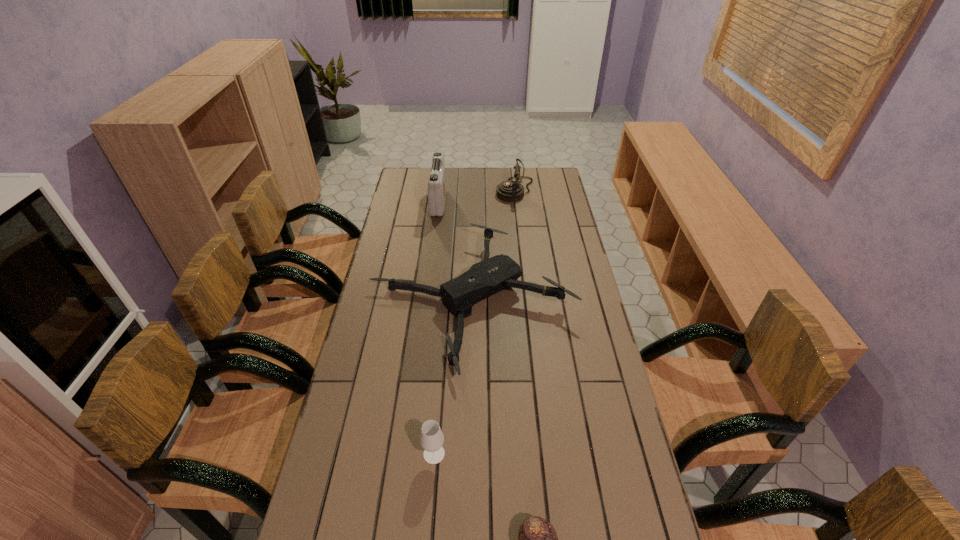
You are a GUI agent. You are given a task and a screenshot of the screen. Output one action in this format:
    pyautogui.click(x=<x>, y=<y>)
    Task: Click on the free location that satisfies the following two spatial constraints: 1. on the front side of the glass; 2. on the right side of the tallest object
    This screenshot has height=540, width=960.
    Given the screenshot: What is the action you would take?
    pyautogui.click(x=406, y=454)